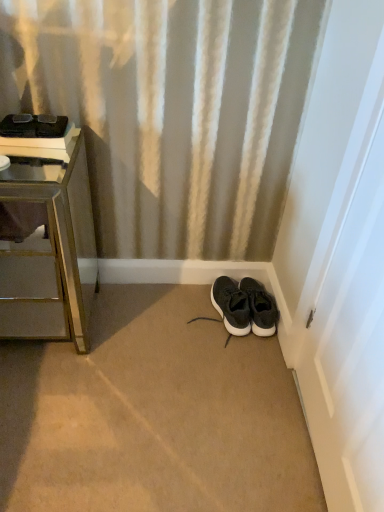
The image size is (384, 512). Identify the location of free location to the right of brushed metal nightstand at left. (137, 336).